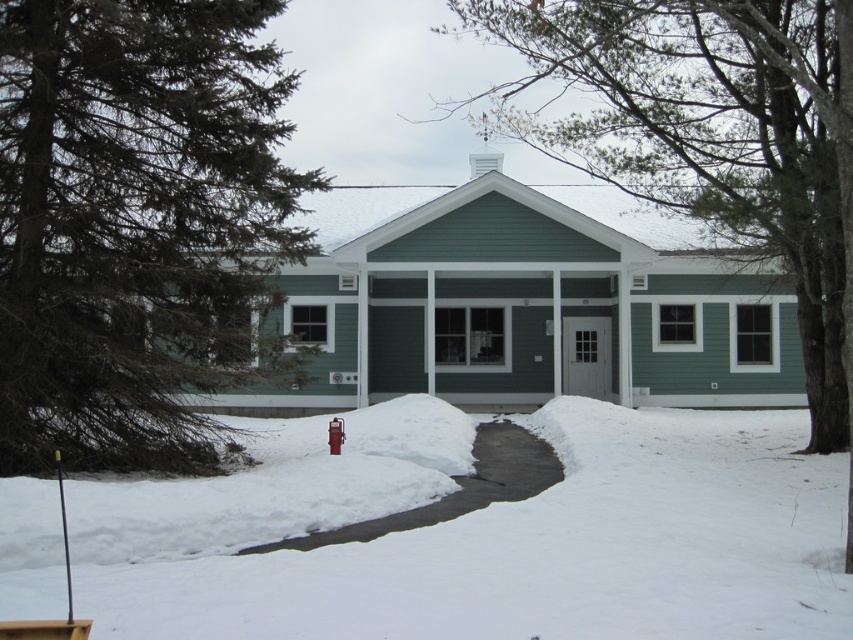
Question: Is white powdery snow at center to the left of green wood tree at center from the viewer's perspective?

Choices:
 (A) no
 (B) yes

Answer: (B)

Question: Which of the following is the farthest from the observer?

Choices:
 (A) red metallic hydrant at center
 (B) green wood tree at center
 (C) white powdery snow at center
 (D) green textured pine tree at left

Answer: (A)

Question: Estimate the real-world distances between objects in this image. Which object is closer to the green wood tree at center?

Choices:
 (A) white powdery snow at center
 (B) red metallic hydrant at center

Answer: (A)

Question: Which point is farther from the camera taking this photo?

Choices:
 (A) (334, 433)
 (B) (393, 604)
 (C) (647, 12)

Answer: (A)

Question: Is green textured pine tree at left to the right of white powdery snow at center from the viewer's perspective?

Choices:
 (A) yes
 (B) no

Answer: (B)

Question: Is white powdery snow at center wider than green wood tree at center?

Choices:
 (A) yes
 (B) no

Answer: (A)